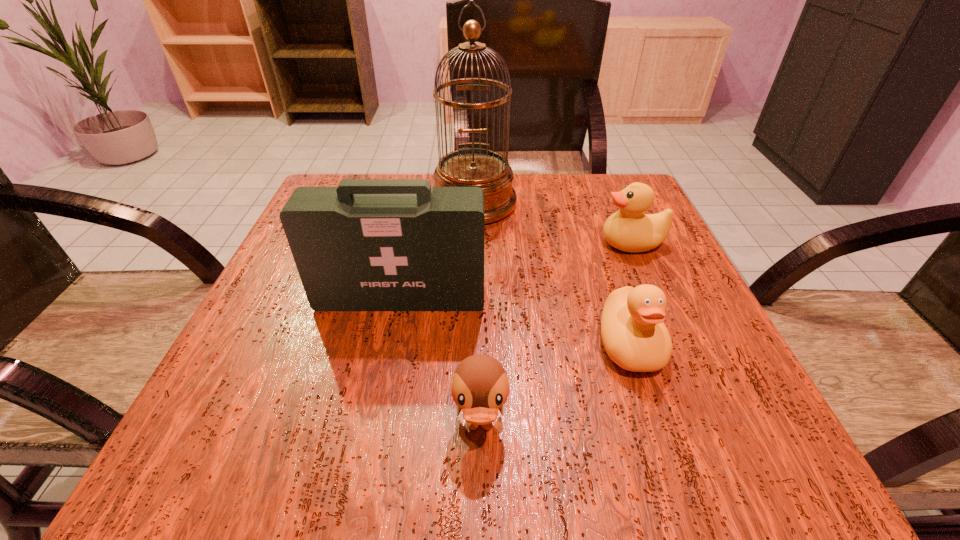
Where is `vacant space located at the beak of the farthest duck`? vacant space located at the beak of the farthest duck is located at coordinates (493, 243).

Find the location of a particular element. This screenshot has width=960, height=540. free location located 0.300m at the beak of the farthest duck is located at coordinates (454, 243).

The image size is (960, 540). Identify the location of vacant space located at the beak of the farthest duck. (449, 243).

What are the coordinates of `free space located on the face of the second farthest duck` in the screenshot? It's located at (654, 417).

At what (x,y) coordinates should I click in order to perform the action: click on object that is at the far edge. Please return your answer as a coordinate pair (x, y). Looking at the image, I should click on (471, 167).

The width and height of the screenshot is (960, 540). In order to click on object that is at the near edge in this screenshot , I will do `click(480, 386)`.

I want to click on object positioned at the left edge, so click(369, 244).

You are a GUI agent. You are given a task and a screenshot of the screen. Output one action in this format:
    pyautogui.click(x=<x>, y=<y>)
    Task: Click on the vacant point at the far edge
    
    Given the screenshot: What is the action you would take?
    pyautogui.click(x=522, y=217)

In the image, there is a desktop. What are the coordinates of `vacant region at the near edge` in the screenshot? It's located at (605, 414).

You are a GUI agent. You are given a task and a screenshot of the screen. Output one action in this format:
    pyautogui.click(x=<x>, y=<y>)
    Task: Click on the vacant area at the right edge
    This screenshot has height=540, width=960.
    Given the screenshot: What is the action you would take?
    pyautogui.click(x=680, y=281)